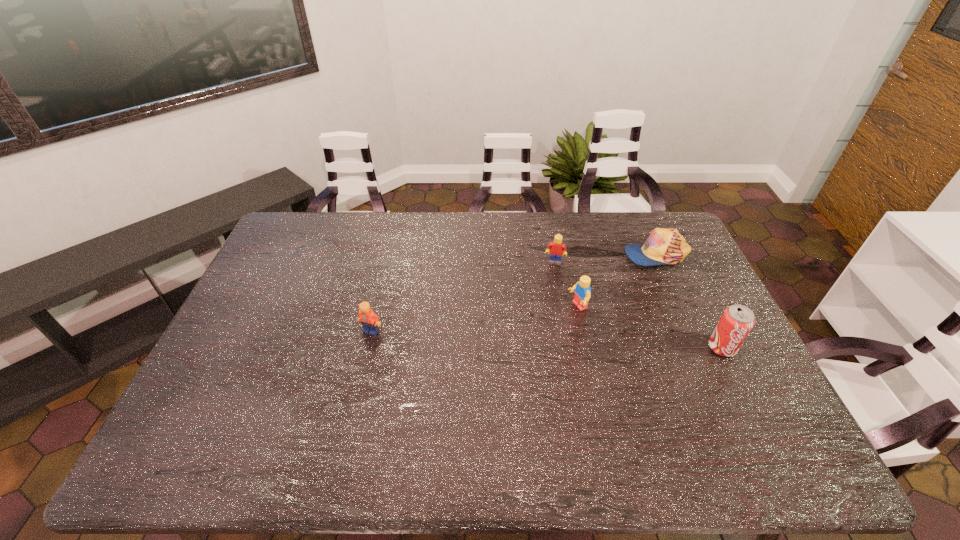
Locate an element on the screen. The width and height of the screenshot is (960, 540). free location that satisfies the following two spatial constraints: 1. on the front side of the nearest object; 2. on the right side of the farthest Lego is located at coordinates (571, 348).